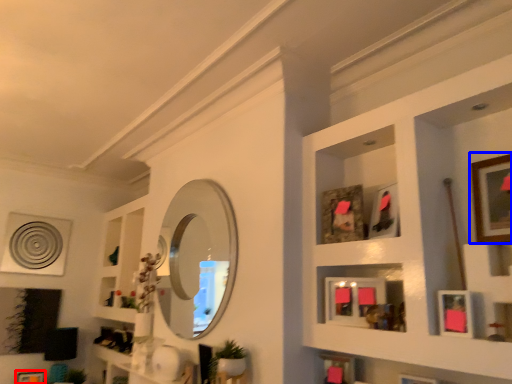
Question: Which object appears closest to the camera in this image, picture frame (highlighted by a red box) or picture frame (highlighted by a blue box)?

Choices:
 (A) picture frame
 (B) picture frame

Answer: (B)